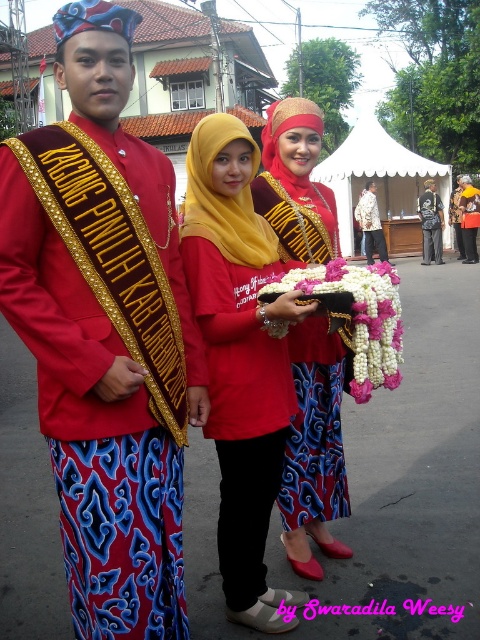
You are a photographer trying to capture the details of the yellow satin hijab at center and the matte gold sash at center. Which object is closer to the camera based on their positions?

The yellow satin hijab at center is closer to the camera because it is in front of the matte gold sash at center.

You are standing in front of the group of three individuals in traditional attire. You want to take a photo that includes both the point at location (223, 145) and the point at (380, 248). Which point should you focus on first to ensure both are in focus?

You should focus on point (223, 145) first because it is closer to the camera than point (380, 248). This way, both points will be in focus as the closer point sets the focal plane.